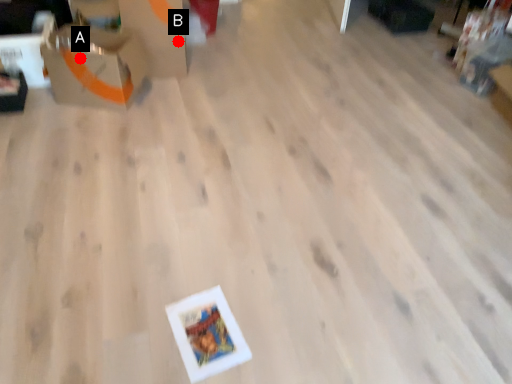
Question: Two points are circled on the image, labeled by A and B beside each circle. Among these points, which one is farthest from the camera?

Choices:
 (A) A is further
 (B) B is further

Answer: (B)